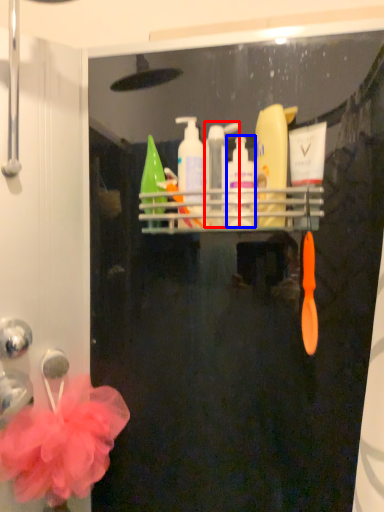
Question: Which object is further to the camera taking this photo, mouthwash (highlighted by a red box) or cleaning product (highlighted by a blue box)?

Choices:
 (A) mouthwash
 (B) cleaning product

Answer: (A)